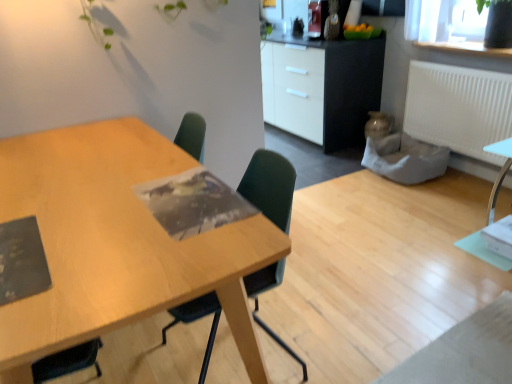
Describe the element at coordinates (458, 108) in the screenshot. I see `white matte radiator at upper right` at that location.

What do you see at coordinates (270, 186) in the screenshot?
I see `green plastic chair at center` at bounding box center [270, 186].

Find the location of `wooden table at center`. wooden table at center is located at coordinates (116, 243).

Locate an element on the screen. white glossy cabinet at upper center is located at coordinates (322, 87).

Is wooden table at center positioned far away from white glossy cabinet at upper center?

Yes, wooden table at center and white glossy cabinet at upper center are located far from each other.

Is wooden table at center wider or thinner than white glossy cabinet at upper center?

Clearly, wooden table at center has more width compared to white glossy cabinet at upper center.

Identify the location of cabinetry located above the wooden table at center (from the image's perspective). Image resolution: width=512 pixels, height=384 pixels. (322, 87).

Is point (90, 248) positioned in front of point (329, 51)?

That is True.

Considering the sizes of green plastic chair at center and wooden table at center in the image, is green plastic chair at center bigger or smaller than wooden table at center?

In the image, green plastic chair at center appears to be smaller than wooden table at center.

Locate an element on the screen. The height and width of the screenshot is (384, 512). chair that appears above the wooden table at center (from a real-world perspective) is located at coordinates point(270,186).

Would you say wooden table at center is part of green plastic chair at center's contents?

No.

From the image's perspective, is green plastic chair at center located beneath wooden table at center?

No, from the image's perspective, green plastic chair at center is not beneath wooden table at center.

Could white matte radiator at upper right be considered to be inside transparent glass vase at upper right?

No, white matte radiator at upper right is not surrounded by transparent glass vase at upper right.

Is transparent glass vase at upper right positioned far away from white matte radiator at upper right?

No, transparent glass vase at upper right is not far from white matte radiator at upper right.

Between transparent glass vase at upper right and white matte radiator at upper right, which one appears on the right side from the viewer's perspective?

transparent glass vase at upper right is more to the right.

Who is shorter, transparent glass vase at upper right or white matte radiator at upper right?

transparent glass vase at upper right.

Considering the relative positions of wooden table at center and transparent glass vase at upper right in the image provided, is wooden table at center to the right of transparent glass vase at upper right from the viewer's perspective?

No.

Find the location of `window screen behind the wooden table at center`. window screen behind the wooden table at center is located at coordinates (436, 26).

Based on the photo, from the image's perspective, which one is positioned lower, wooden table at center or transparent glass vase at upper right?

wooden table at center appears lower in the image.

From a real-world perspective, who is located lower, wooden table at center or transparent glass vase at upper right?

In real-world perspective, wooden table at center is lower.

From a real-world perspective, who is located lower, white glossy cabinet at upper center or green plastic chair at center?

green plastic chair at center is physically lower.

From the image's perspective, is white glossy cabinet at upper center located above green plastic chair at center?

Correct, white glossy cabinet at upper center appears higher than green plastic chair at center in the image.

Considering the sizes of objects white glossy cabinet at upper center and green plastic chair at center in the image provided, who is bigger, white glossy cabinet at upper center or green plastic chair at center?

Bigger between the two is white glossy cabinet at upper center.

Considering the relative positions of white glossy cabinet at upper center and green plastic chair at center in the image provided, is white glossy cabinet at upper center to the right of green plastic chair at center from the viewer's perspective?

Yes, white glossy cabinet at upper center is to the right of green plastic chair at center.

Is green plastic chair at center in front of or behind white glossy cabinet at upper center in the image?

In the image, green plastic chair at center appears in front of white glossy cabinet at upper center.

Consider the image. How many degrees apart are the facing directions of green plastic chair at center and white glossy cabinet at upper center?

The angular difference between green plastic chair at center and white glossy cabinet at upper center is 3.61 degrees.

Is green plastic chair at center outside of white glossy cabinet at upper center?

Yes, green plastic chair at center is located beyond the bounds of white glossy cabinet at upper center.

Considering the positions of objects green plastic chair at center and white glossy cabinet at upper center in the image provided, who is more to the right, green plastic chair at center or white glossy cabinet at upper center?

white glossy cabinet at upper center.

Between wooden table at center and green plastic chair at center, which one has smaller width?

Thinner between the two is green plastic chair at center.

This screenshot has height=384, width=512. In order to click on chair located on the right of wooden table at center in this screenshot , I will do `click(270, 186)`.

From the image's perspective, is wooden table at center beneath green plastic chair at center?

Yes, from the image's perspective, wooden table at center is below green plastic chair at center.

Which is farther, (150, 176) or (287, 216)?

The point (150, 176) is behind.

Identify the location of cabinetry that appears behind the wooden table at center. The image size is (512, 384). (322, 87).

In order to click on table on the left of the green plastic chair at center in this screenshot , I will do `click(116, 243)`.

From the image, which object appears to be farther from transparent glass vase at upper right, white glossy cabinet at upper center or wooden table at center?

Among the two, wooden table at center is located further to transparent glass vase at upper right.

Looking at the image, which one is located closer to white glossy cabinet at upper center, green plastic chair at center or transparent glass vase at upper right?

Based on the image, transparent glass vase at upper right appears to be nearer to white glossy cabinet at upper center.

From the image, which object appears to be nearer to transparent glass vase at upper right, green plastic chair at center or white matte radiator at upper right?

white matte radiator at upper right is positioned closer to the anchor transparent glass vase at upper right.

Looking at the image, which one is located closer to white matte radiator at upper right, transparent glass vase at upper right or white glossy cabinet at upper center?

transparent glass vase at upper right.

Based on their spatial positions, is wooden table at center or white matte radiator at upper right closer to white glossy cabinet at upper center?

Among the two, white matte radiator at upper right is located nearer to white glossy cabinet at upper center.

Based on their spatial positions, is white matte radiator at upper right or transparent glass vase at upper right closer to white glossy cabinet at upper center?

white matte radiator at upper right is closer to white glossy cabinet at upper center.

When comparing their distances from wooden table at center, does transparent glass vase at upper right or green plastic chair at center seem closer?

green plastic chair at center is positioned closer to the anchor wooden table at center.

Estimate the real-world distances between objects in this image. Which object is further from wooden table at center, white matte radiator at upper right or green plastic chair at center?

white matte radiator at upper right.

The width and height of the screenshot is (512, 384). I want to click on window screen positioned between green plastic chair at center and white glossy cabinet at upper center from near to far, so click(436, 26).

The height and width of the screenshot is (384, 512). What are the coordinates of `radiator between green plastic chair at center and white glossy cabinet at upper center in the front-back direction` in the screenshot? It's located at (458, 108).

Where is `radiator between wooden table at center and white glossy cabinet at upper center in the front-back direction`? The height and width of the screenshot is (384, 512). radiator between wooden table at center and white glossy cabinet at upper center in the front-back direction is located at coordinates (458, 108).

This screenshot has width=512, height=384. I want to click on window screen between wooden table at center and white glossy cabinet at upper center from front to back, so click(x=436, y=26).